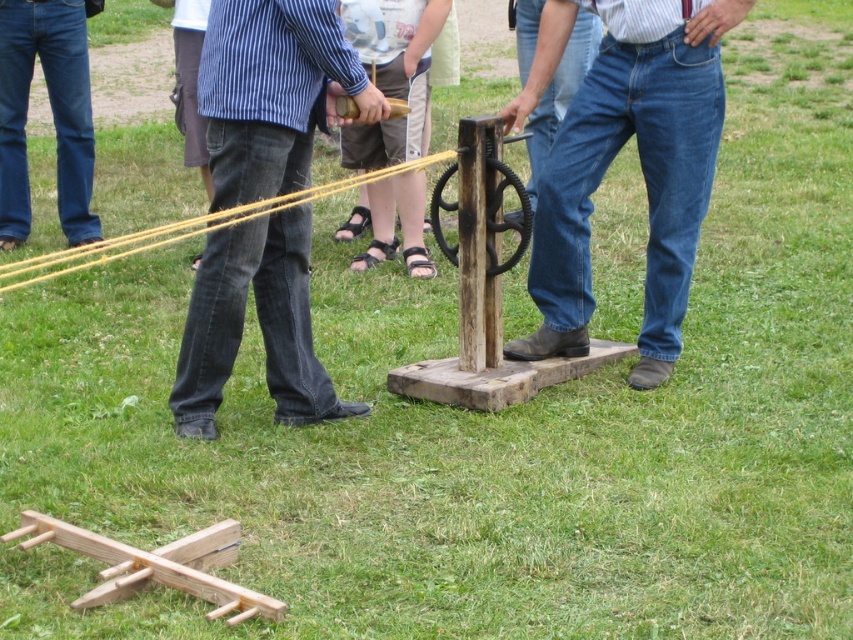
You are a tailor who needs to choose between the denim jeans at left and the blue jeans at center for a client who prefers a snug fit. Which pair should you recommend?

The denim jeans at left has a smaller size compared to blue jeans at center, so you should recommend the denim jeans at left for the client who prefers a snug fit.

You are standing in the scene and see the denim jeans at left and the blue jeans at left. Which pair of jeans is located to the right of the other?

The denim jeans at left is positioned on the right side of blue jeans at left, so the denim jeans at left is to the right of the blue jeans at left.

You are a fashion designer observing the scene. You notice two pairs of blue jeans in the image. Which pair of blue jeans at center or blue jeans at left would you recommend for a client who prefers larger sizes?

The blue jeans at center is bigger than blue jeans at left, so I would recommend the blue jeans at center for a client who prefers larger sizes.